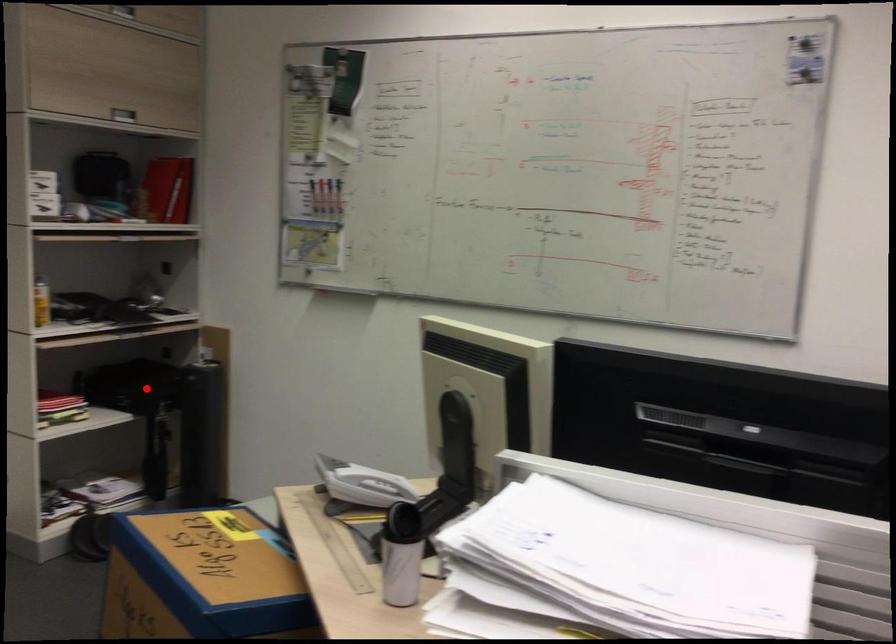
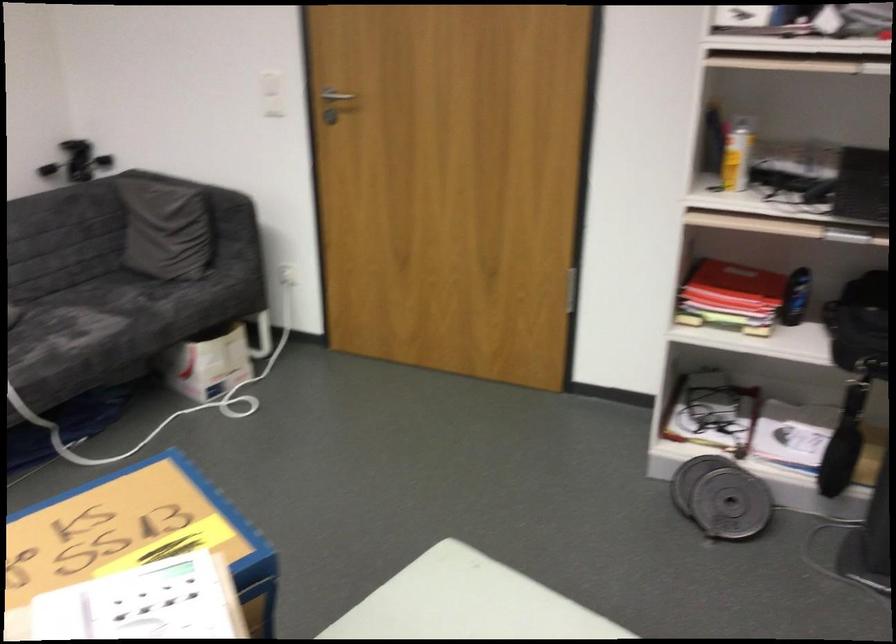
Where in the second image is the point corresponding to the highlighted location from the first image?

(859, 325)